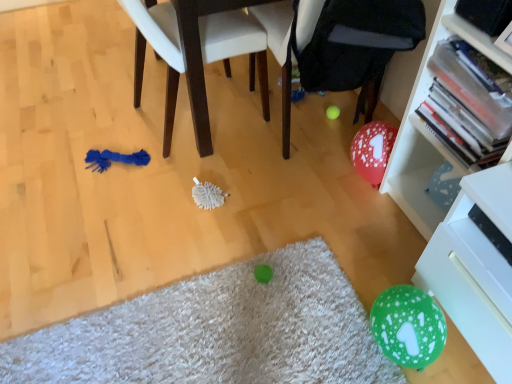
Question: Is green fuzzy mat at lower center at the left side of black fabric bean bag chair at center?

Choices:
 (A) yes
 (B) no

Answer: (A)

Question: From a real-world perspective, does green fuzzy mat at lower center stand above black fabric bean bag chair at center?

Choices:
 (A) yes
 (B) no

Answer: (B)

Question: From the image's perspective, is green fuzzy mat at lower center beneath black fabric bean bag chair at center?

Choices:
 (A) yes
 (B) no

Answer: (A)

Question: Can you confirm if green fuzzy mat at lower center is thinner than black fabric bean bag chair at center?

Choices:
 (A) yes
 (B) no

Answer: (A)

Question: Is green fuzzy mat at lower center shorter than black fabric bean bag chair at center?

Choices:
 (A) no
 (B) yes

Answer: (B)

Question: From a real-world perspective, is green fuzzy mat at lower center physically below black fabric bean bag chair at center?

Choices:
 (A) no
 (B) yes

Answer: (B)

Question: From the image's perspective, is blue fabric chair at left under green fuzzy mat at lower center?

Choices:
 (A) yes
 (B) no

Answer: (B)

Question: Could you tell me if blue fabric chair at left is facing green fuzzy mat at lower center?

Choices:
 (A) no
 (B) yes

Answer: (A)

Question: Is blue fabric chair at left far from green fuzzy mat at lower center?

Choices:
 (A) yes
 (B) no

Answer: (B)

Question: Does blue fabric chair at left contain green fuzzy mat at lower center?

Choices:
 (A) no
 (B) yes

Answer: (A)

Question: Does blue fabric chair at left have a greater width compared to green fuzzy mat at lower center?

Choices:
 (A) no
 (B) yes

Answer: (B)

Question: Is the depth of blue fabric chair at left less than that of green fuzzy mat at lower center?

Choices:
 (A) no
 (B) yes

Answer: (A)

Question: Considering the relative sizes of white glossy drawer at lower right and blue fabric chair at left in the image provided, is white glossy drawer at lower right taller than blue fabric chair at left?

Choices:
 (A) yes
 (B) no

Answer: (B)